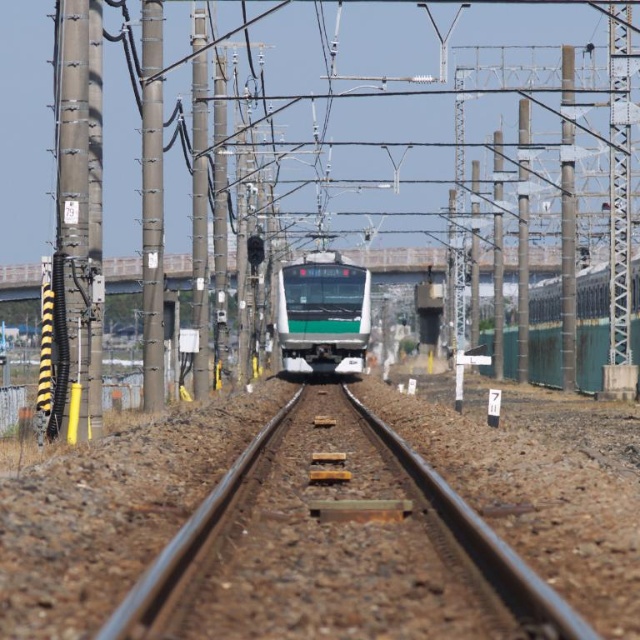
You are a photographer standing at the center of the railway. You want to capture a photo where the green matte train at center is larger than the smooth metal train track at center. Is this possible given their current sizes?

The smooth metal train track at center is bigger than the green matte train at center. Therefore, it is not possible to capture a photo where the green matte train at center is larger than the smooth metal train track at center because the track is already larger in size.

You are a passenger on the green matte train at center and want to know the position of the smooth metal train track at center relative to your current seat. From your perspective inside the train, is the track to your left or right?

The smooth metal train track at center is to the right of the green matte train at center, so from your perspective inside the train, the track would be on your right side.

You are a railway inspector checking the alignment of the tracks. You notice the smooth metal train track at center and the green matte train at center. Which object is located below the other?

The smooth metal train track at center is positioned under the green matte train at center.